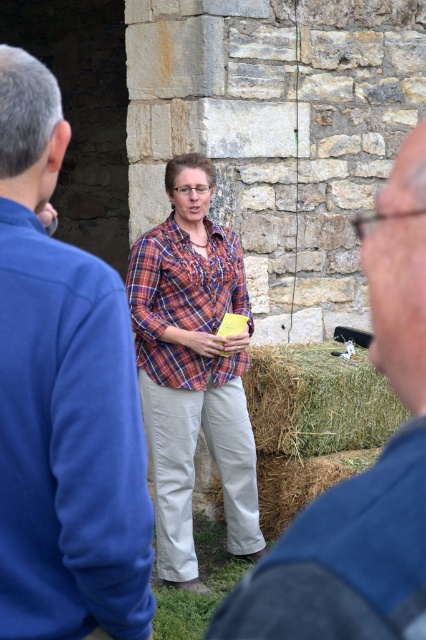
Question: Which object appears closest to the camera in this image?

Choices:
 (A) straw bale at center
 (B) blue fleece jacket at center
 (C) plaid shirt at center
 (D) green straw bale at lower center

Answer: (B)

Question: Which object appears closest to the camera in this image?

Choices:
 (A) green straw bale at lower center
 (B) blue fleece jacket at center
 (C) blue fabric shirt at center

Answer: (C)

Question: Can you confirm if blue fleece jacket at center is bigger than green straw bale at lower center?

Choices:
 (A) no
 (B) yes

Answer: (A)

Question: In this image, where is blue fabric shirt at center located relative to straw bale at center?

Choices:
 (A) right
 (B) left

Answer: (B)

Question: Is green straw bale at lower center further to camera compared to straw bale at center?

Choices:
 (A) no
 (B) yes

Answer: (B)

Question: Which object appears farthest from the camera in this image?

Choices:
 (A) blue fleece jacket at center
 (B) plaid shirt at center

Answer: (B)